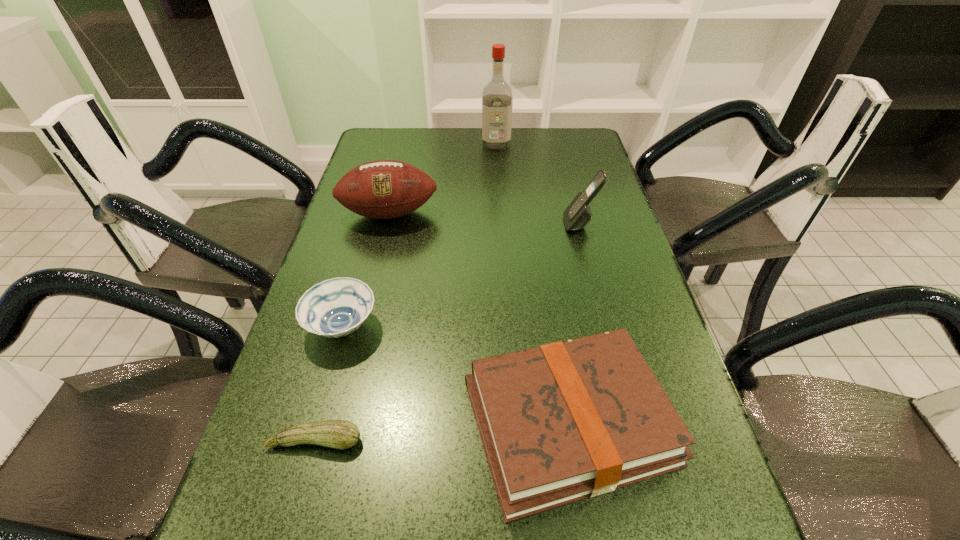
Identify the location of hardback book at the right edge. (569, 420).

Where is `vacant area at the far edge of the desktop`? The image size is (960, 540). vacant area at the far edge of the desktop is located at coordinates (540, 129).

At what (x,y) coordinates should I click in order to perform the action: click on free region at the left edge of the desktop. Please return your answer as a coordinate pair (x, y). Looking at the image, I should click on (259, 453).

Locate an element on the screen. vacant space at the right edge is located at coordinates (624, 312).

This screenshot has height=540, width=960. What are the coordinates of `vacant space at the far left corner` in the screenshot? It's located at (400, 156).

Identify the location of free space at the far right corner of the desktop. (577, 152).

Identify the location of unoccupied area between the tallest object and the cellular telephone. This screenshot has width=960, height=540. (538, 184).

Find the location of `vacant space that's between the fourth tallest object and the cellular telephone`. vacant space that's between the fourth tallest object and the cellular telephone is located at coordinates (574, 323).

The width and height of the screenshot is (960, 540). In order to click on unoccupied position between the fourth tallest object and the football (American) in this screenshot , I will do `click(479, 318)`.

Locate an element on the screen. The image size is (960, 540). vacant point located between the cellular telephone and the soup bowl is located at coordinates (461, 275).